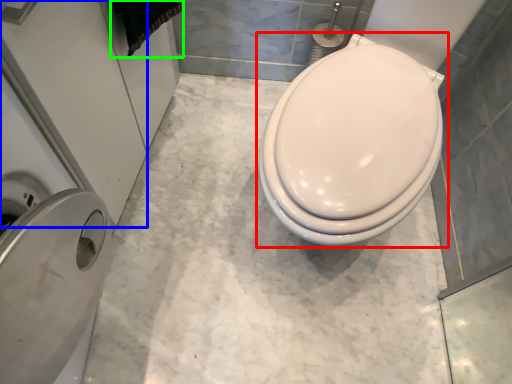
Question: Which is nearer to the toilet (highlighted by a red box)? screen door (highlighted by a blue box) or material (highlighted by a green box).

Choices:
 (A) screen door
 (B) material

Answer: (B)